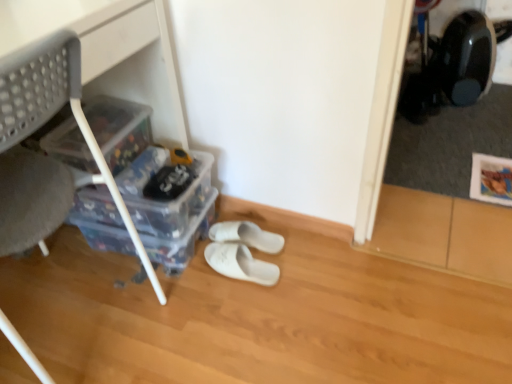
Locate an element on the screen. This screenshot has height=384, width=512. clear plastic storage box at left, which ranks as the 3th storage box in bottom-to-top order is located at coordinates (119, 129).

How much space does transparent plastic storage box at lower left, positioned as the third storage box in top-to-bottom order, occupy vertically?

The height of transparent plastic storage box at lower left, positioned as the third storage box in top-to-bottom order, is 5.30 inches.

Describe the element at coordinates (240, 263) in the screenshot. I see `white fabric slippers at center, marked as the 2th footwear in a back-to-front arrangement` at that location.

This screenshot has width=512, height=384. What are the coordinates of `white fabric slippers at center, which is counted as the second footwear, starting from the front` in the screenshot? It's located at (247, 235).

At what (x,y) coordinates should I click in order to perform the action: click on clear plastic storage box at left, arranged as the first storage box when viewed from the top. Please return your answer as a coordinate pair (x, y). Image resolution: width=512 pixels, height=384 pixels. Looking at the image, I should click on (119, 129).

From the picture: From a real-world perspective, is white fabric slippers at center, which is counted as the second footwear, starting from the front, beneath transparent plastic storage box at lower left, the first storage box positioned from the bottom?

Yes, from a real-world perspective, white fabric slippers at center, which is counted as the second footwear, starting from the front, is beneath transparent plastic storage box at lower left, the first storage box positioned from the bottom.

The width and height of the screenshot is (512, 384). Identify the location of the 1st footwear below the transparent plastic storage box at lower left, positioned as the third storage box in top-to-bottom order (from the image's perspective). (247, 235).

Is the depth of white fabric slippers at center, which is the 1th footwear from back to front, greater than that of transparent plastic storage box at lower left, positioned as the third storage box in top-to-bottom order?

Yes.

This screenshot has height=384, width=512. Identify the location of the 2nd footwear directly beneath the clear plastic storage box at left, which ranks as the 3th storage box in bottom-to-top order (from a real-world perspective). (240, 263).

Would you say white fabric slippers at center, the first footwear from the front, is inside or outside clear plastic storage box at left, which ranks as the 3th storage box in bottom-to-top order?

white fabric slippers at center, the first footwear from the front, is located beyond the bounds of clear plastic storage box at left, which ranks as the 3th storage box in bottom-to-top order.

Does white fabric slippers at center, marked as the 2th footwear in a back-to-front arrangement, turn towards clear plastic storage box at left, arranged as the first storage box when viewed from the top?

No, white fabric slippers at center, marked as the 2th footwear in a back-to-front arrangement, is not oriented towards clear plastic storage box at left, arranged as the first storage box when viewed from the top.

Does point (236, 264) lie in front of point (100, 134)?

No.

Considering the relative positions of white fabric slippers at center, marked as the 2th footwear in a back-to-front arrangement, and transparent plastic storage box at lower left, positioned as the third storage box in top-to-bottom order, in the image provided, is white fabric slippers at center, marked as the 2th footwear in a back-to-front arrangement, in front of transparent plastic storage box at lower left, positioned as the third storage box in top-to-bottom order,?

Yes, it is in front of transparent plastic storage box at lower left, positioned as the third storage box in top-to-bottom order.

Which is in front, point (212, 245) or point (87, 242)?

Point (212, 245)

From the image's perspective, between white fabric slippers at center, the first footwear from the front, and transparent plastic storage box at lower left, positioned as the third storage box in top-to-bottom order, who is located below?

white fabric slippers at center, the first footwear from the front.

How different are the orientations of white fabric slippers at center, the first footwear from the front, and transparent plastic storage box at lower left, the first storage box positioned from the bottom, in degrees?

The angular difference between white fabric slippers at center, the first footwear from the front, and transparent plastic storage box at lower left, the first storage box positioned from the bottom, is 0.000443 degrees.

Which of these two, white plastic chair at left or clear plastic storage box at left, arranged as the first storage box when viewed from the top, is bigger?

Bigger between the two is white plastic chair at left.

Based on the photo, which is behind, white plastic chair at left or clear plastic storage box at left, which ranks as the 3th storage box in bottom-to-top order?

clear plastic storage box at left, which ranks as the 3th storage box in bottom-to-top order, is further away from the camera.

Between white plastic chair at left and clear plastic storage box at left, which ranks as the 3th storage box in bottom-to-top order, which one has less height?

clear plastic storage box at left, which ranks as the 3th storage box in bottom-to-top order, is shorter.

Is clear plastic storage box at left, arranged as the first storage box when viewed from the top, positioned beyond the bounds of clear plastic storage box at lower left, acting as the 2th storage box starting from the top?

That's correct, clear plastic storage box at left, arranged as the first storage box when viewed from the top, is outside of clear plastic storage box at lower left, acting as the 2th storage box starting from the top.

Is clear plastic storage box at left, which ranks as the 3th storage box in bottom-to-top order, directly adjacent to clear plastic storage box at lower left, acting as the 2th storage box starting from the top?

They are not placed beside each other.

Image resolution: width=512 pixels, height=384 pixels. In order to click on storage box that appears above the clear plastic storage box at lower left, arranged as the second storage box when ordered from the bottom (from a real-world perspective) in this screenshot , I will do 119,129.

Is clear plastic storage box at lower left, acting as the 2th storage box starting from the top, in contact with white fabric slippers at center, which is the 1th footwear from back to front?

clear plastic storage box at lower left, acting as the 2th storage box starting from the top, and white fabric slippers at center, which is the 1th footwear from back to front, are clearly separated.

Does clear plastic storage box at lower left, arranged as the second storage box when ordered from the bottom, contain white fabric slippers at center, which is the 1th footwear from back to front?

Definitely not — white fabric slippers at center, which is the 1th footwear from back to front, is not inside clear plastic storage box at lower left, arranged as the second storage box when ordered from the bottom.

Is clear plastic storage box at lower left, acting as the 2th storage box starting from the top, positioned behind white fabric slippers at center, which is counted as the second footwear, starting from the front?

No, it is in front of white fabric slippers at center, which is counted as the second footwear, starting from the front.

Visually, is transparent plastic storage box at lower left, the first storage box positioned from the bottom, positioned to the left or to the right of white plastic chair at left?

Clearly, transparent plastic storage box at lower left, the first storage box positioned from the bottom, is on the right of white plastic chair at left in the image.

Measure the distance between transparent plastic storage box at lower left, the first storage box positioned from the bottom, and white plastic chair at left.

transparent plastic storage box at lower left, the first storage box positioned from the bottom, and white plastic chair at left are 12.50 inches apart from each other.

Is white plastic chair at left inside transparent plastic storage box at lower left, positioned as the third storage box in top-to-bottom order?

No, white plastic chair at left is not surrounded by transparent plastic storage box at lower left, positioned as the third storage box in top-to-bottom order.

Find the location of a particular element. The height and width of the screenshot is (384, 512). footwear behind the transparent plastic storage box at lower left, the first storage box positioned from the bottom is located at coordinates (247, 235).

You are a GUI agent. You are given a task and a screenshot of the screen. Output one action in this format:
    pyautogui.click(x=<x>, y=<y>)
    Task: Click on the 1st storage box in front of the white fabric slippers at center, the first footwear from the front
    This screenshot has width=512, height=384.
    Given the screenshot: What is the action you would take?
    pyautogui.click(x=119, y=129)

Looking at the image, which one is located closer to white fabric slippers at center, which is the 1th footwear from back to front, clear plastic storage box at lower left, acting as the 2th storage box starting from the top, or white fabric slippers at center, the first footwear from the front?

white fabric slippers at center, the first footwear from the front, is closer to white fabric slippers at center, which is the 1th footwear from back to front.

Based on their spatial positions, is white plastic chair at left or clear plastic storage box at left, which ranks as the 3th storage box in bottom-to-top order, closer to transparent plastic storage box at lower left, positioned as the third storage box in top-to-bottom order?

clear plastic storage box at left, which ranks as the 3th storage box in bottom-to-top order, lies closer to transparent plastic storage box at lower left, positioned as the third storage box in top-to-bottom order, than the other object.

Which object lies further to the anchor point clear plastic storage box at left, which ranks as the 3th storage box in bottom-to-top order, clear plastic storage box at lower left, arranged as the second storage box when ordered from the bottom, or white fabric slippers at center, which is counted as the second footwear, starting from the front?

white fabric slippers at center, which is counted as the second footwear, starting from the front, is positioned further to the anchor clear plastic storage box at left, which ranks as the 3th storage box in bottom-to-top order.

Looking at the image, which one is located closer to white fabric slippers at center, marked as the 2th footwear in a back-to-front arrangement, white plastic chair at left or clear plastic storage box at lower left, arranged as the second storage box when ordered from the bottom?

The object closer to white fabric slippers at center, marked as the 2th footwear in a back-to-front arrangement, is clear plastic storage box at lower left, arranged as the second storage box when ordered from the bottom.

Considering their positions, is clear plastic storage box at lower left, arranged as the second storage box when ordered from the bottom, positioned closer to white fabric slippers at center, the first footwear from the front, than white plastic chair at left?

clear plastic storage box at lower left, arranged as the second storage box when ordered from the bottom, is closer to white fabric slippers at center, the first footwear from the front.

Which object lies nearer to the anchor point clear plastic storage box at left, arranged as the first storage box when viewed from the top, white plastic chair at left or clear plastic storage box at lower left, acting as the 2th storage box starting from the top?

clear plastic storage box at lower left, acting as the 2th storage box starting from the top, is closer to clear plastic storage box at left, arranged as the first storage box when viewed from the top.

Based on their spatial positions, is white fabric slippers at center, which is counted as the second footwear, starting from the front, or white plastic chair at left further from white fabric slippers at center, the first footwear from the front?

white plastic chair at left lies further to white fabric slippers at center, the first footwear from the front, than the other object.

Based on their spatial positions, is clear plastic storage box at lower left, acting as the 2th storage box starting from the top, or white plastic chair at left further from white fabric slippers at center, which is the 1th footwear from back to front?

white plastic chair at left is positioned further to the anchor white fabric slippers at center, which is the 1th footwear from back to front.

Where is `footwear situated between clear plastic storage box at left, arranged as the first storage box when viewed from the top, and white fabric slippers at center, which is counted as the second footwear, starting from the front, from left to right`? footwear situated between clear plastic storage box at left, arranged as the first storage box when viewed from the top, and white fabric slippers at center, which is counted as the second footwear, starting from the front, from left to right is located at coordinates (240, 263).

At what (x,y) coordinates should I click in order to perform the action: click on footwear between white plastic chair at left and transparent plastic storage box at lower left, the first storage box positioned from the bottom, along the z-axis. Please return your answer as a coordinate pair (x, y). This screenshot has width=512, height=384. Looking at the image, I should click on [x=240, y=263].

You are a GUI agent. You are given a task and a screenshot of the screen. Output one action in this format:
    pyautogui.click(x=<x>, y=<y>)
    Task: Click on the footwear situated between transparent plastic storage box at lower left, the first storage box positioned from the bottom, and white fabric slippers at center, which is the 1th footwear from back to front, from left to right
    This screenshot has width=512, height=384.
    Given the screenshot: What is the action you would take?
    pyautogui.click(x=240, y=263)

Where is `storage box between clear plastic storage box at lower left, acting as the 2th storage box starting from the top, and white fabric slippers at center, marked as the 2th footwear in a back-to-front arrangement`? The height and width of the screenshot is (384, 512). storage box between clear plastic storage box at lower left, acting as the 2th storage box starting from the top, and white fabric slippers at center, marked as the 2th footwear in a back-to-front arrangement is located at coordinates (182, 239).